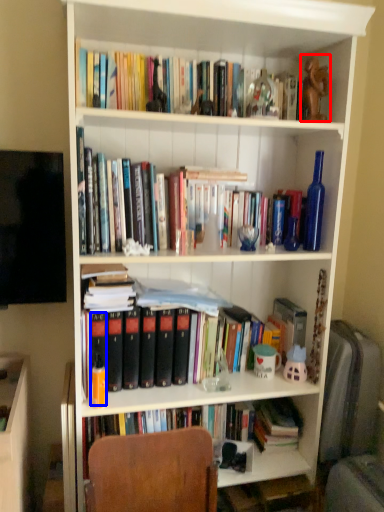
Question: Which of the following is the closest to the observer, toy (highlighted by a red box) or paperback book (highlighted by a blue box)?

Choices:
 (A) toy
 (B) paperback book

Answer: (B)